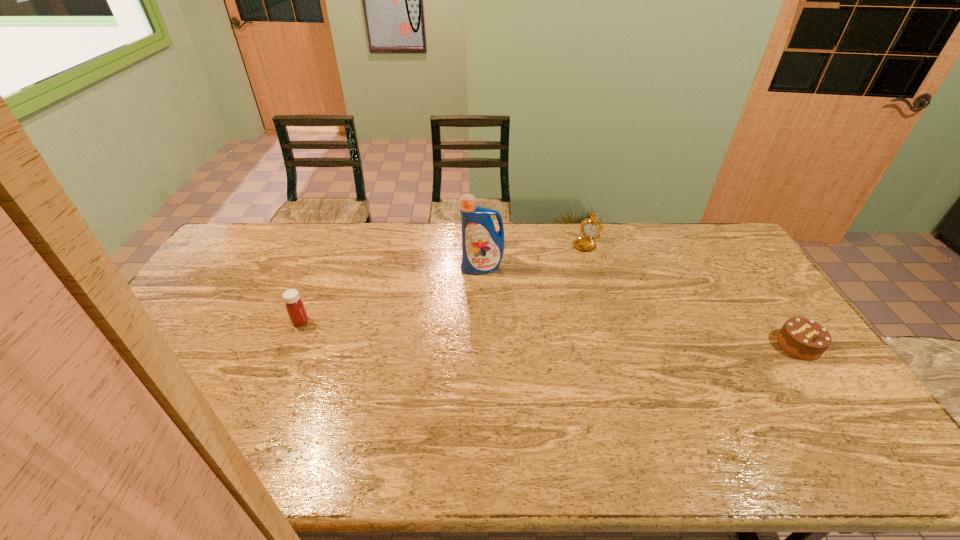
What are the coordinates of `vacant area at the right edge of the desktop` in the screenshot? It's located at (720, 293).

Identify the location of vacant region at the far left corner of the desktop. (246, 234).

This screenshot has width=960, height=540. I want to click on vacant region at the far right corner of the desktop, so click(x=729, y=256).

Find the location of `vacant space that's between the leftmost object and the tallest object`. vacant space that's between the leftmost object and the tallest object is located at coordinates (392, 294).

I want to click on vacant space in between the tallest object and the third farthest object, so click(x=392, y=294).

This screenshot has width=960, height=540. In order to click on vacant space that's between the farthest object and the medicine in this screenshot , I will do `click(447, 284)`.

In order to click on blank region between the pocket watch and the tallest object in this screenshot , I will do `click(538, 256)`.

I want to click on free space between the third farthest object and the chocolate cake, so click(x=550, y=333).

The image size is (960, 540). In order to click on free space between the farthest object and the leftmost object in this screenshot , I will do pos(447,284).

This screenshot has height=540, width=960. I want to click on blank region between the second nearest object and the rightmost object, so click(550, 333).